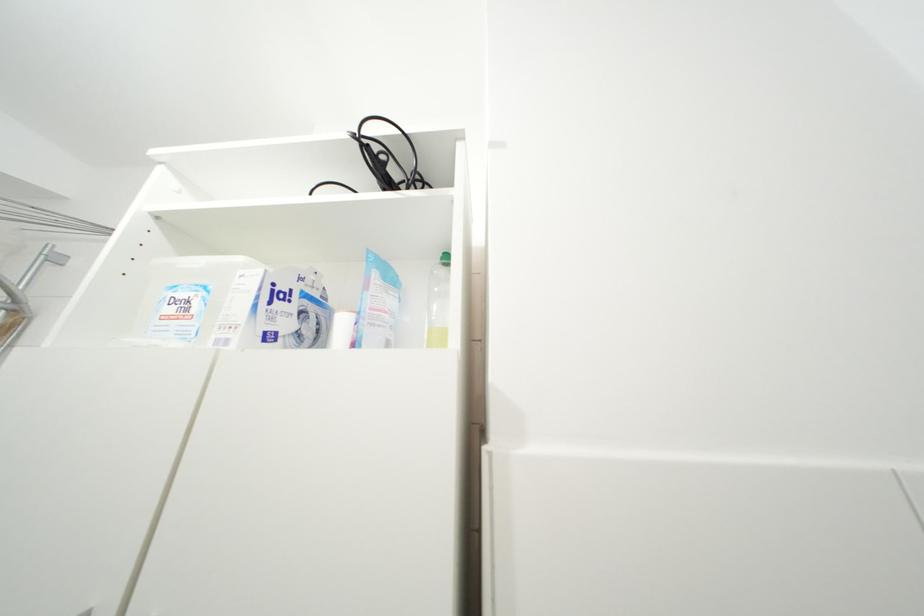
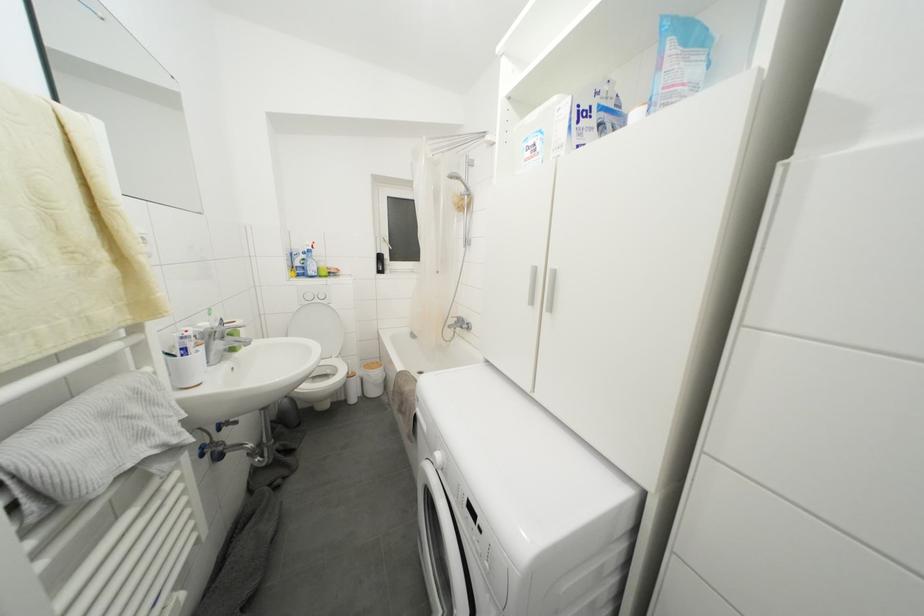
Locate, in the second image, the point that corresponds to [390,317] in the first image.

(687, 89)